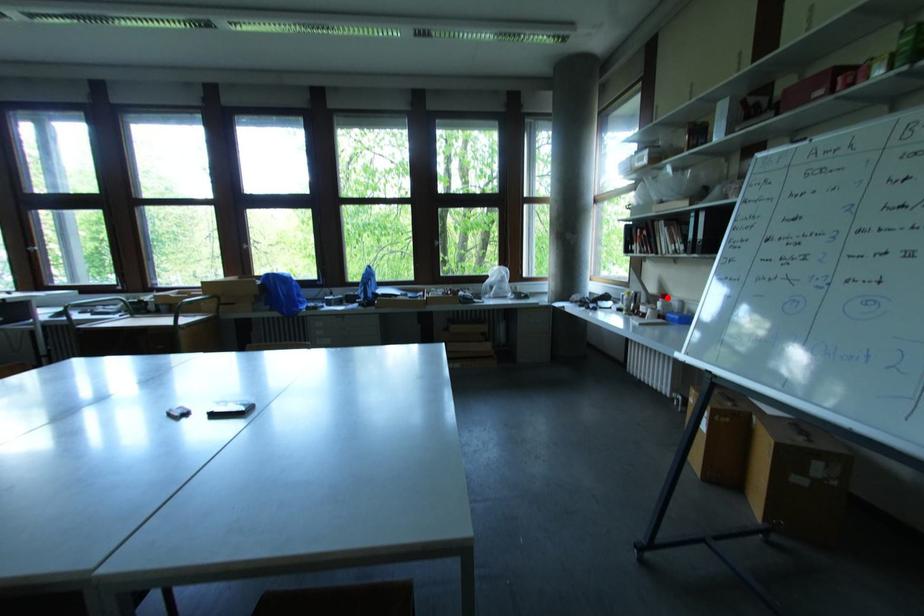
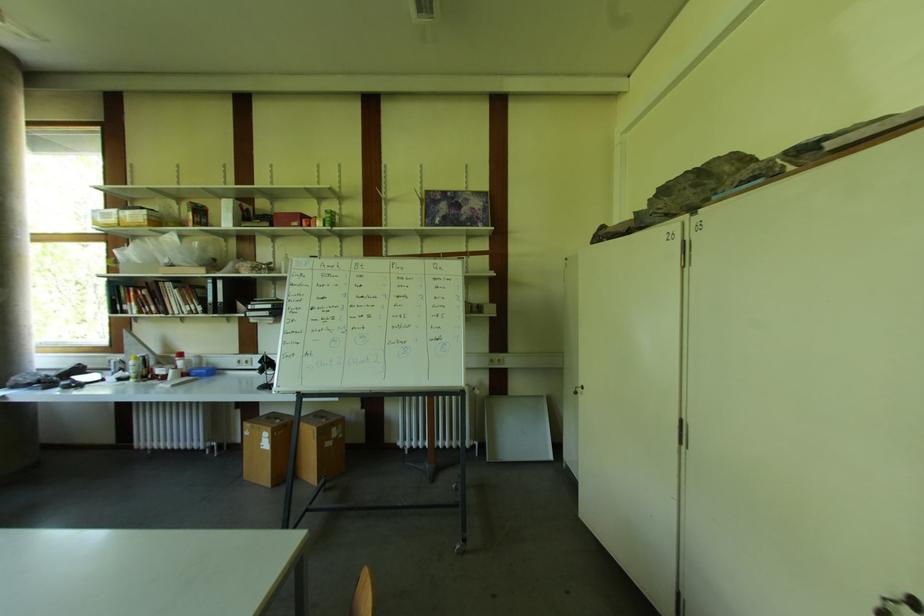
The point at the highlighted location is marked in the first image. Where is the corresponding point in the second image?

(184, 357)